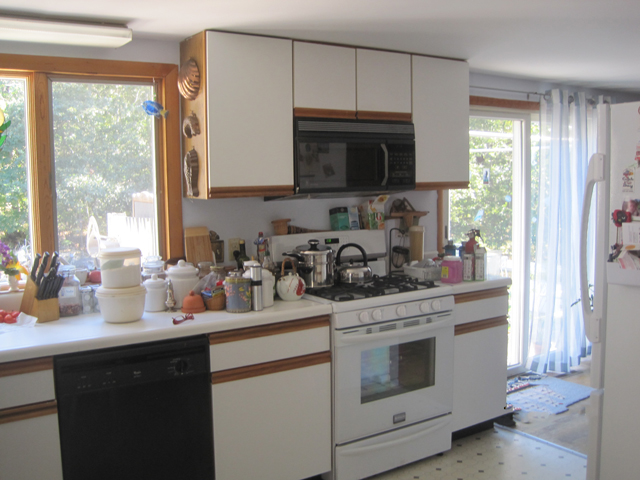
In order to click on fridge in this screenshot , I will do `click(610, 335)`.